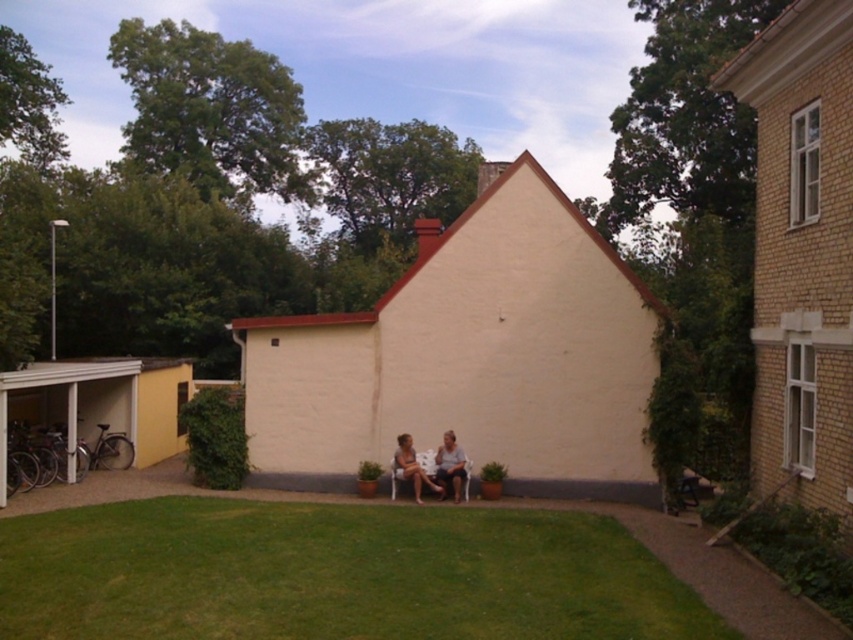
You are standing in front of the building and see the matte white chairs at center and the smooth beige shirt at center. Which object is positioned more to the left side?

The matte white chairs at center are positioned to the left of the smooth beige shirt at center, so they are more to the left side.

Consider the image. You are standing in front of the small building and notice two points marked on the wall. The first point is at coordinates point (445, 464) and the second is at point (456, 493). Which point is closer to you?

Point (445, 464) is further to the camera than point (456, 493), so the point closer to you would be point (456, 493).

You are a visitor approaching the building and want to sit down. There are two objects at the center of the scene. Which object is closer to the building wall? The matte white chairs at center or the smooth beige shirt at center?

The matte white chairs at center is positioned under smooth beige shirt at center, so the matte white chairs at center is closer to the building wall than the smooth beige shirt at center.